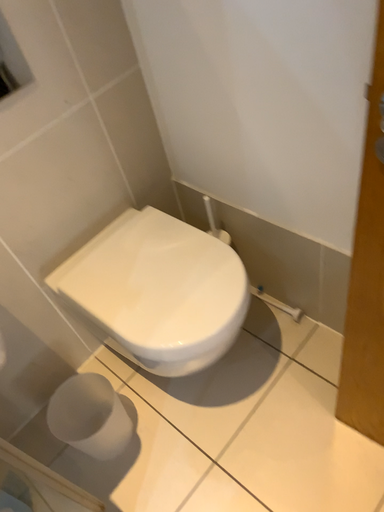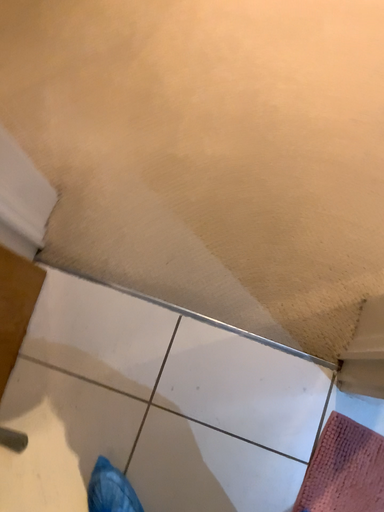
Question: Which way did the camera rotate in the video?

Choices:
 (A) rotated upward
 (B) rotated downward

Answer: (A)